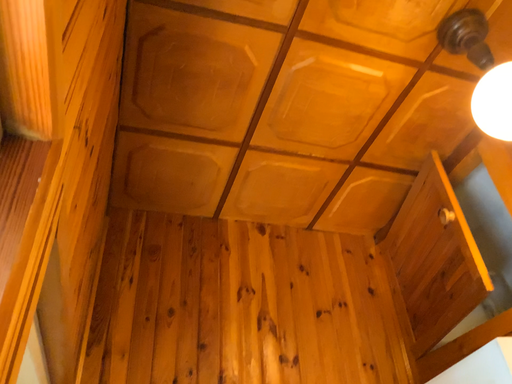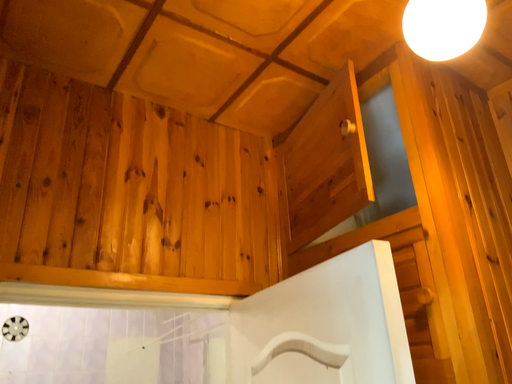
Question: How did the camera likely rotate when shooting the video?

Choices:
 (A) rotated upward
 (B) rotated downward

Answer: (B)